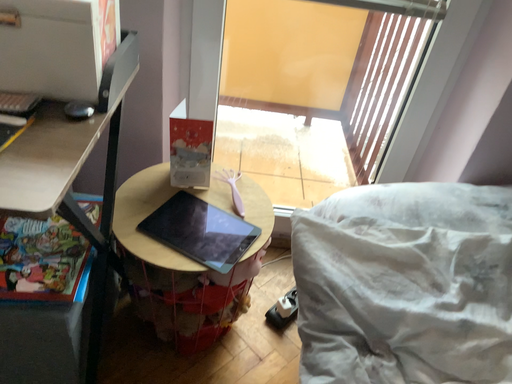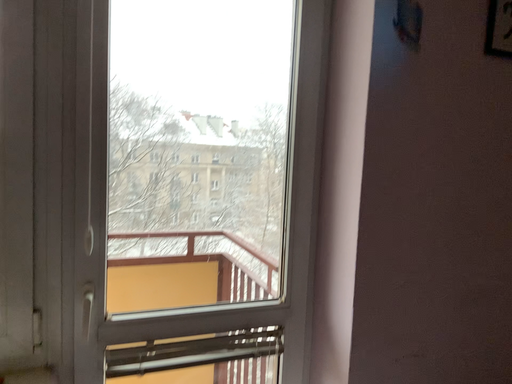
Question: Which way did the camera rotate in the video?

Choices:
 (A) rotated right
 (B) rotated left

Answer: (A)